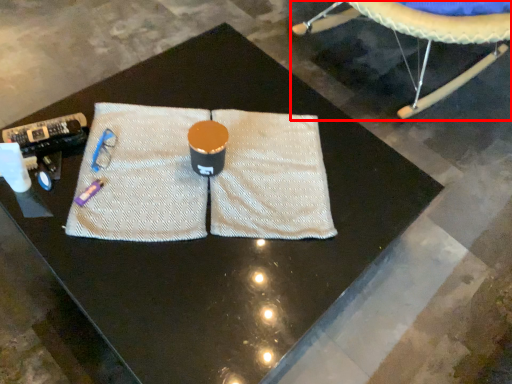
Question: From the image's perspective, where is swivel chair (annotated by the red box) located relative to yoga mat?

Choices:
 (A) above
 (B) below

Answer: (A)